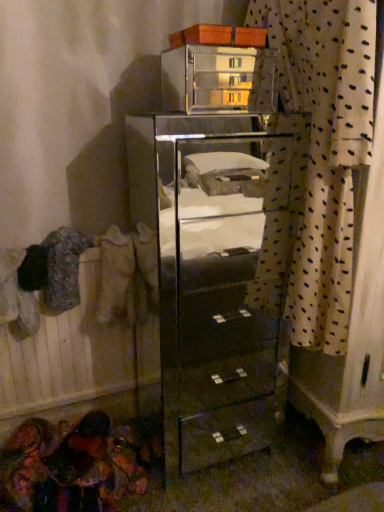
I want to click on free spot to the right of clear glass cabinet at center, so click(x=295, y=451).